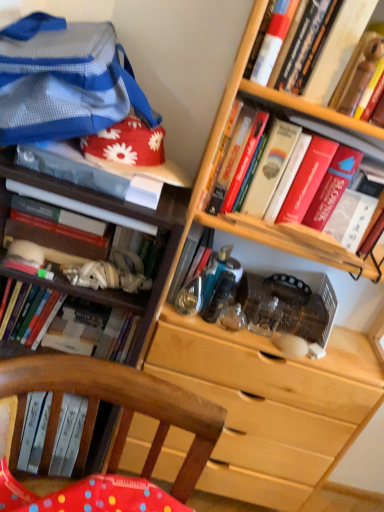
Where is `free point above matte white book at upper left, acting as the 6th book starting from the right (from a real-world perspective)`? free point above matte white book at upper left, acting as the 6th book starting from the right (from a real-world perspective) is located at coordinates 112,156.